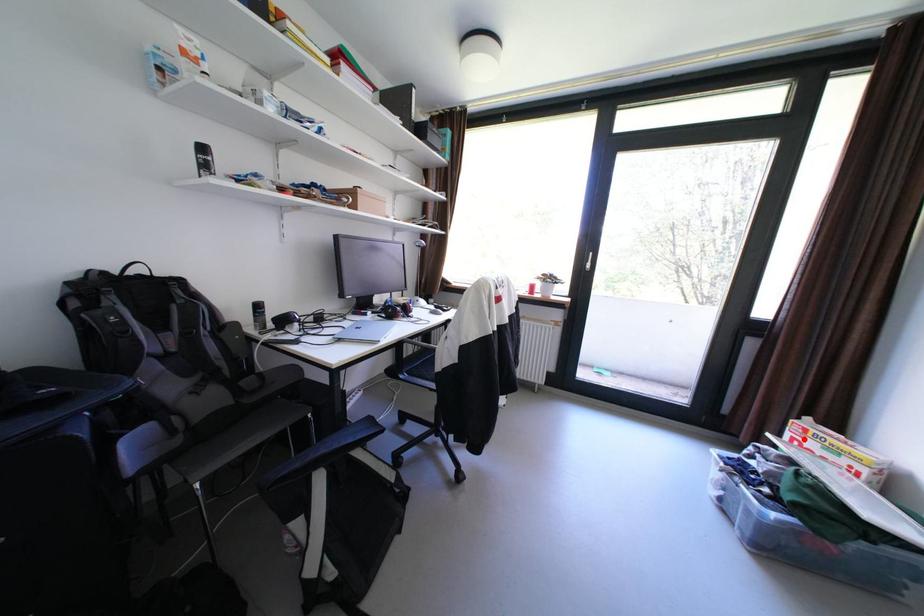
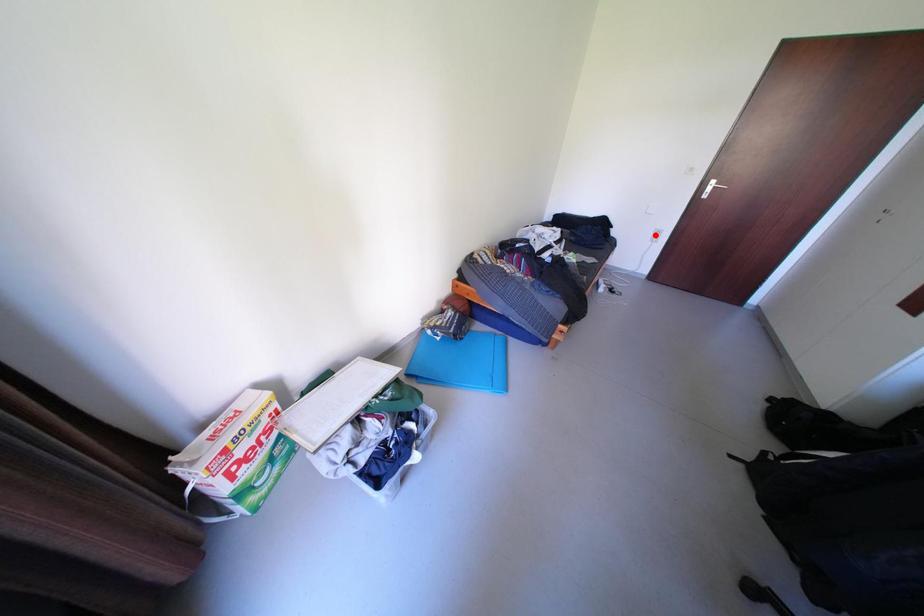
I am providing you with two images of the same scene from different viewpoints. A red point is marked on the first image and another point is marked on the second image. Does the point marked in image1 correspond to the same location as the one in image2?

No